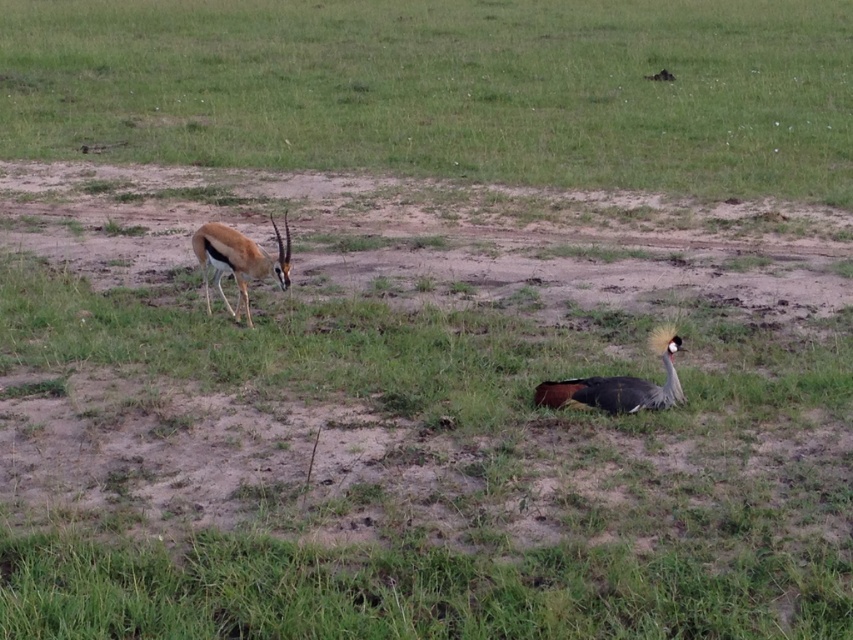
Question: Where is green grass at center located in relation to brown glossy antelope at left in the image?

Choices:
 (A) above
 (B) below

Answer: (A)

Question: Observing the image, what is the correct spatial positioning of green grass at center in reference to brown glossy antelope at left?

Choices:
 (A) right
 (B) left

Answer: (A)

Question: Which object is closer to the camera taking this photo?

Choices:
 (A) green grass at center
 (B) gray feathered bird at lower right

Answer: (B)

Question: Is green grass at center thinner than gray feathered bird at lower right?

Choices:
 (A) yes
 (B) no

Answer: (B)

Question: Which point is closer to the camera taking this photo?

Choices:
 (A) (543, 381)
 (B) (209, 250)
 (C) (637, 163)

Answer: (A)

Question: Which of these objects is positioned farthest from the brown glossy antelope at left?

Choices:
 (A) green grass at center
 (B) gray feathered bird at lower right

Answer: (A)